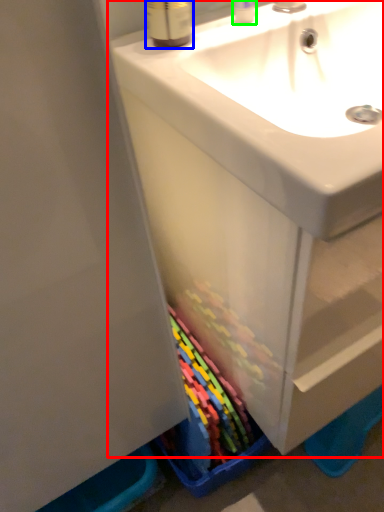
Question: Based on their relative distances, which object is farther from bathroom cabinet (highlighted by a red box)? Choose from mouthwash (highlighted by a blue box) and toiletry (highlighted by a green box).

Choices:
 (A) mouthwash
 (B) toiletry

Answer: (B)